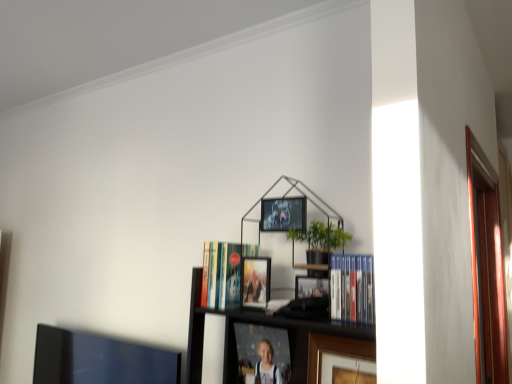
Question: Choose the correct answer: Is gold-framed photo at center, which appears as the third picture frame when viewed from the top, inside metallic silver picture frame at upper center, marked as the first picture frame in a top-to-bottom arrangement, or outside it?

Choices:
 (A) inside
 (B) outside

Answer: (B)

Question: Is gold-framed photo at center, acting as the second picture frame starting from the bottom, taller or shorter than metallic silver picture frame at upper center, which is the fourth picture frame from bottom to top?

Choices:
 (A) short
 (B) tall

Answer: (B)

Question: Which object is positioned closest to the gold-framed photo at center, acting as the second picture frame starting from the bottom?

Choices:
 (A) metallic silver picture frame at upper center, which is the fourth picture frame from bottom to top
 (B) hardcover book at center, which is the 2th book in right-to-left order
 (C) transparent glass door at right
 (D) matte plastic picture frame at center, which is the 4th picture frame in top-to-bottom order
 (E) matte black picture frame at center, positioned as the 2th picture frame in top-to-bottom order

Answer: (D)

Question: Which of these objects is positioned farthest from the transparent glass door at right?

Choices:
 (A) matte black picture frame at center, positioned as the 2th picture frame in top-to-bottom order
 (B) matte plastic picture frame at center, which is the 4th picture frame in top-to-bottom order
 (C) metallic silver picture frame at upper center, which is the fourth picture frame from bottom to top
 (D) blue hardcover books at center-right, positioned as the second book in back-to-front order
 (E) gold-framed photo at center, acting as the second picture frame starting from the bottom

Answer: (A)